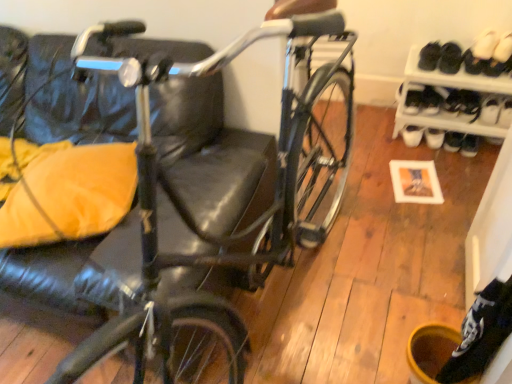
Question: Is the depth of shiny black bicycle at center greater than that of white suede shoe at upper right, the third footwear when ordered from left to right?

Choices:
 (A) no
 (B) yes

Answer: (A)

Question: Is shiny black bicycle at center aimed at white suede shoe at upper right, which is the first footwear in right-to-left order?

Choices:
 (A) yes
 (B) no

Answer: (B)

Question: Considering the relative sizes of shiny black bicycle at center and white suede shoe at upper right, the third footwear when ordered from left to right, in the image provided, is shiny black bicycle at center wider than white suede shoe at upper right, the third footwear when ordered from left to right,?

Choices:
 (A) no
 (B) yes

Answer: (B)

Question: Would you say white suede shoe at upper right, the third footwear when ordered from left to right, is part of shiny black bicycle at center's contents?

Choices:
 (A) no
 (B) yes

Answer: (A)

Question: Is shiny black bicycle at center to the right of white suede shoe at upper right, the third footwear when ordered from left to right, from the viewer's perspective?

Choices:
 (A) yes
 (B) no

Answer: (B)

Question: Can you confirm if shiny black bicycle at center is bigger than white suede shoe at upper right, the third footwear when ordered from left to right?

Choices:
 (A) no
 (B) yes

Answer: (B)

Question: Considering the relative sizes of white suede shoe at upper right, which is the first footwear in right-to-left order, and shiny black bicycle at center in the image provided, is white suede shoe at upper right, which is the first footwear in right-to-left order, smaller than shiny black bicycle at center?

Choices:
 (A) no
 (B) yes

Answer: (B)

Question: Is white suede shoe at upper right, which is the first footwear in right-to-left order, bigger than shiny black bicycle at center?

Choices:
 (A) no
 (B) yes

Answer: (A)

Question: Is the position of white suede shoe at upper right, which is the first footwear in right-to-left order, more distant than that of shiny black bicycle at center?

Choices:
 (A) no
 (B) yes

Answer: (B)

Question: Is shiny black bicycle at center at the back of white suede shoe at upper right, the third footwear when ordered from left to right?

Choices:
 (A) no
 (B) yes

Answer: (A)

Question: Does white suede shoe at upper right, which is the first footwear in right-to-left order, have a lesser width compared to shiny black bicycle at center?

Choices:
 (A) no
 (B) yes

Answer: (B)

Question: From the image's perspective, is white suede shoe at upper right, the third footwear when ordered from left to right, located beneath shiny black bicycle at center?

Choices:
 (A) yes
 (B) no

Answer: (B)

Question: Considering the relative positions of white leather shoe at right and shiny black bicycle at center in the image provided, is white leather shoe at right behind shiny black bicycle at center?

Choices:
 (A) yes
 (B) no

Answer: (A)